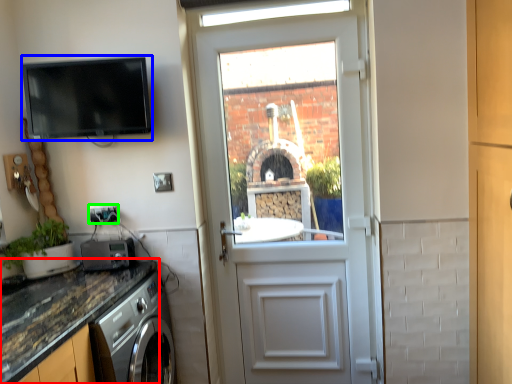
Question: Based on their relative distances, which object is farther from countertop (highlighted by a red box)? Choose from appliance (highlighted by a blue box) and electric outlet (highlighted by a green box).

Choices:
 (A) appliance
 (B) electric outlet

Answer: (A)